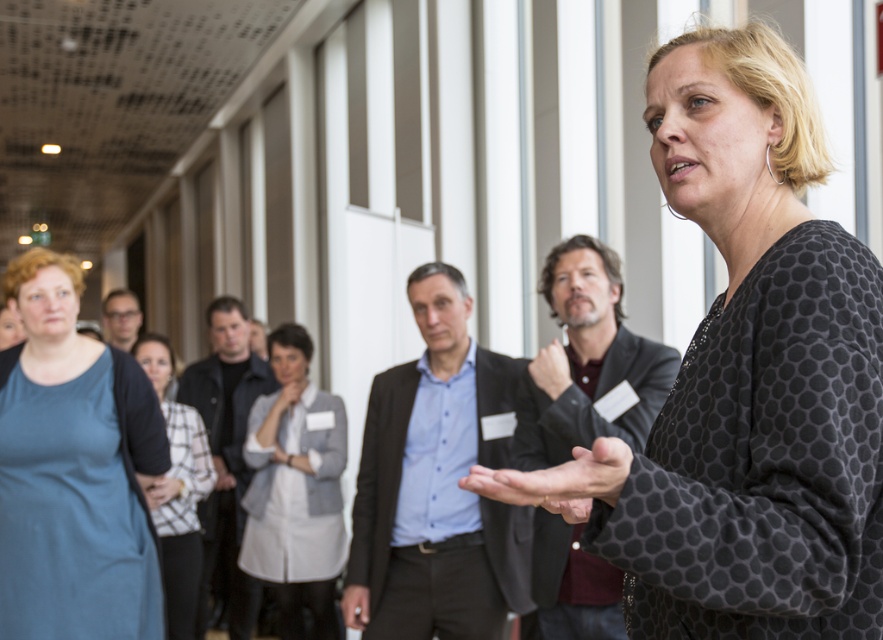
Question: Does matte blue shirt at left have a smaller size compared to light gray fabric jacket at center?

Choices:
 (A) no
 (B) yes

Answer: (B)

Question: Does polka dot fabric at center appear on the right side of light gray fabric jacket at center?

Choices:
 (A) no
 (B) yes

Answer: (B)

Question: Estimate the real-world distances between objects in this image. Which object is farther from the matte blue shirt at left?

Choices:
 (A) light gray fabric jacket at center
 (B) white textured blouse at center
 (C) polka dot fabric at center

Answer: (C)

Question: Based on their relative distances, which object is nearer to the matte blue shirt at left?

Choices:
 (A) light gray fabric jacket at center
 (B) polka dot fabric at center

Answer: (A)

Question: Does polka dot fabric at center appear on the right side of light gray fabric jacket at center?

Choices:
 (A) no
 (B) yes

Answer: (B)

Question: Estimate the real-world distances between objects in this image. Which object is closer to the white textured blouse at center?

Choices:
 (A) light gray fabric jacket at center
 (B) matte blue shirt at left
 (C) polka dot fabric at center

Answer: (A)